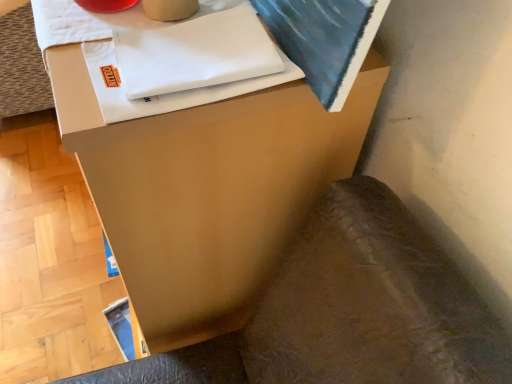
Measure the distance between point (245, 293) and camera.

The distance of point (245, 293) from camera is 72.30 centimeters.

The image size is (512, 384). What are the coordinates of `matte brown side table at center` in the screenshot? It's located at (207, 189).

What do you see at coordinates (207, 189) in the screenshot?
I see `matte brown side table at center` at bounding box center [207, 189].

What is the approximate height of brown leather swivel chair at lower right?

30.53 inches.

The height and width of the screenshot is (384, 512). What do you see at coordinates (349, 311) in the screenshot?
I see `brown leather swivel chair at lower right` at bounding box center [349, 311].

Measure the distance between brown leather swivel chair at lower right and camera.

brown leather swivel chair at lower right and camera are 32.40 centimeters apart from each other.

Locate an element on the screen. The width and height of the screenshot is (512, 384). brown leather swivel chair at lower right is located at coordinates (349, 311).

Identify the location of matte brown side table at center. This screenshot has height=384, width=512. (207, 189).

From the picture: Considering the relative positions of matte brown side table at center and brown leather swivel chair at lower right in the image provided, is matte brown side table at center to the left of brown leather swivel chair at lower right from the viewer's perspective?

Correct, you'll find matte brown side table at center to the left of brown leather swivel chair at lower right.

In the image, is matte brown side table at center positioned in front of or behind brown leather swivel chair at lower right?

matte brown side table at center is positioned farther from the viewer than brown leather swivel chair at lower right.

Is point (151, 227) behind point (362, 186)?

Yes, point (151, 227) is farther from viewer.

From the image's perspective, which object appears higher, matte brown side table at center or brown leather swivel chair at lower right?

From the image's view, matte brown side table at center is above.

From a real-world perspective, is matte brown side table at center beneath brown leather swivel chair at lower right?

Incorrect, from a real-world perspective, matte brown side table at center is higher than brown leather swivel chair at lower right.

Between matte brown side table at center and brown leather swivel chair at lower right, which one has smaller width?

Thinner between the two is matte brown side table at center.

Who is taller, matte brown side table at center or brown leather swivel chair at lower right?

matte brown side table at center is taller.

Is matte brown side table at center bigger than brown leather swivel chair at lower right?

Yes, matte brown side table at center is bigger than brown leather swivel chair at lower right.

Would you say matte brown side table at center is outside brown leather swivel chair at lower right?

Yes, matte brown side table at center is located beyond the bounds of brown leather swivel chair at lower right.

Is matte brown side table at center with brown leather swivel chair at lower right?

No, matte brown side table at center is not in contact with brown leather swivel chair at lower right.

Is brown leather swivel chair at lower right at the back of matte brown side table at center?

That's not correct — matte brown side table at center is not looking away from brown leather swivel chair at lower right.

How different are the orientations of matte brown side table at center and brown leather swivel chair at lower right in degrees?

3.21 degrees separate the facing orientations of matte brown side table at center and brown leather swivel chair at lower right.

Identify the location of furniture behind the brown leather swivel chair at lower right. (207, 189).

Visually, is brown leather swivel chair at lower right positioned to the left or to the right of matte brown side table at center?

From the image, it's evident that brown leather swivel chair at lower right is to the right of matte brown side table at center.

Does brown leather swivel chair at lower right come behind matte brown side table at center?

No, brown leather swivel chair at lower right is in front of matte brown side table at center.

Which is nearer, (254, 347) or (230, 330)?

Point (254, 347) is closer to the camera than point (230, 330).

From the image's perspective, does brown leather swivel chair at lower right appear higher than matte brown side table at center?

Incorrect, from the image's perspective, brown leather swivel chair at lower right is lower than matte brown side table at center.

From a real-world perspective, is brown leather swivel chair at lower right physically located above or below matte brown side table at center?

brown leather swivel chair at lower right is below matte brown side table at center.

Does brown leather swivel chair at lower right have a greater width compared to matte brown side table at center?

Yes, brown leather swivel chair at lower right is wider than matte brown side table at center.

Does brown leather swivel chair at lower right have a lesser height compared to matte brown side table at center?

Yes.

Based on the photo, is brown leather swivel chair at lower right smaller than matte brown side table at center?

Yes.

Can matte brown side table at center be found inside brown leather swivel chair at lower right?

No, brown leather swivel chair at lower right does not contain matte brown side table at center.

Are brown leather swivel chair at lower right and matte brown side table at center far apart?

Actually, brown leather swivel chair at lower right and matte brown side table at center are a little close together.

Is brown leather swivel chair at lower right aimed at matte brown side table at center?

No, brown leather swivel chair at lower right is not aimed at matte brown side table at center.

From the picture: How many degrees apart are the facing directions of brown leather swivel chair at lower right and matte brown side table at center?

3.21 degrees.

Locate an element on the screen. furniture that appears above the brown leather swivel chair at lower right (from the image's perspective) is located at coordinates point(207,189).

Locate an element on the screen. swivel chair on the right of matte brown side table at center is located at coordinates (349, 311).

Where is `furniture above the brown leather swivel chair at lower right (from the image's perspective)`? The width and height of the screenshot is (512, 384). furniture above the brown leather swivel chair at lower right (from the image's perspective) is located at coordinates (207, 189).